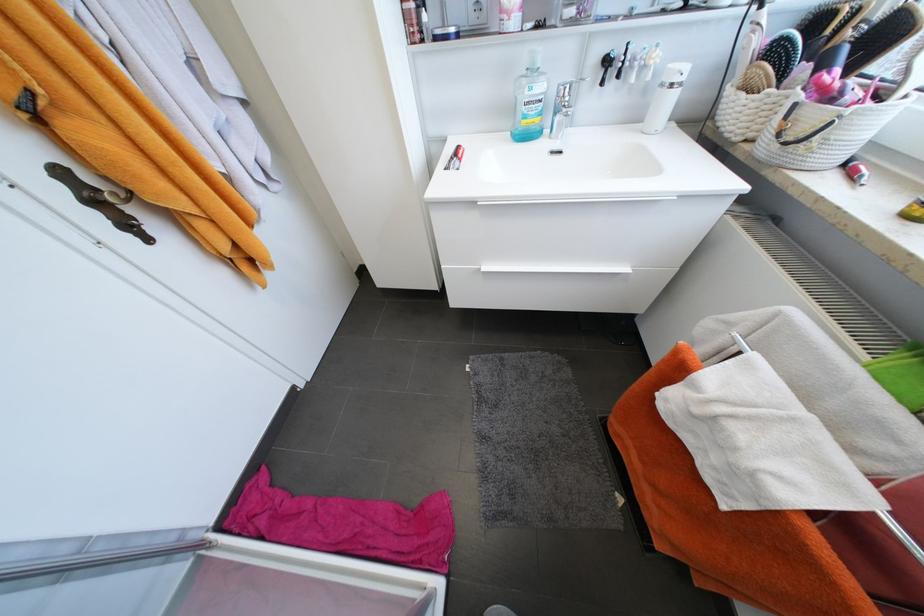
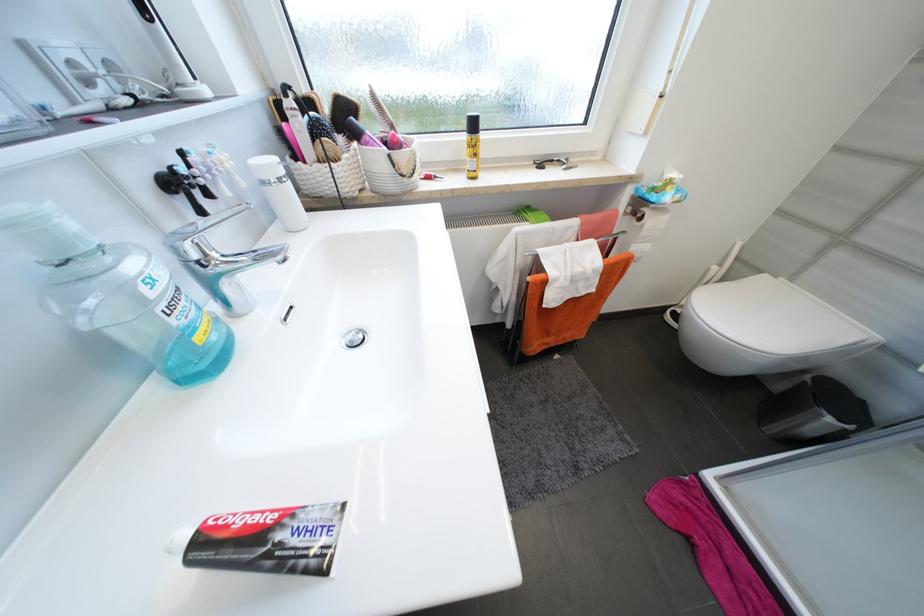
Find the pixel in the second image that matches the point at 529,123 in the first image.

(203, 339)